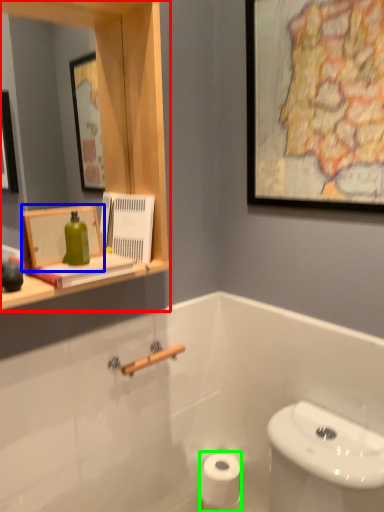
Question: Which object is positioned farthest from medicine cabinet (highlighted by a red box)? Select from picture frame (highlighted by a blue box) and toilet paper (highlighted by a green box).

Choices:
 (A) picture frame
 (B) toilet paper

Answer: (B)